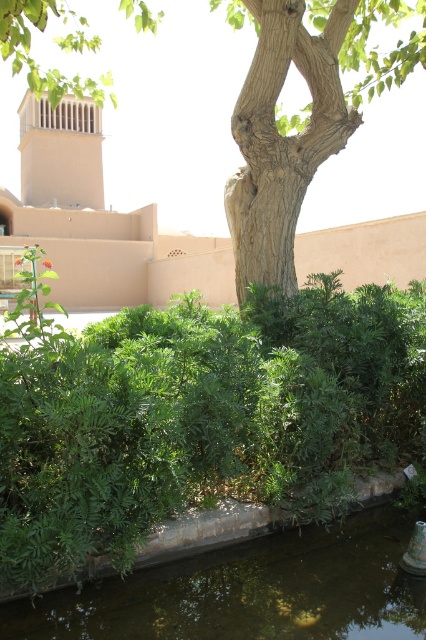
Question: Can you confirm if green leafy hedge at center is positioned to the right of greenish concrete water at bottom?

Choices:
 (A) no
 (B) yes

Answer: (A)

Question: Is green leafy hedge at center in front of smooth brown tree trunk at center?

Choices:
 (A) yes
 (B) no

Answer: (A)

Question: Which object is positioned closest to the greenish concrete water at bottom?

Choices:
 (A) smooth brown tree trunk at center
 (B) green leafy hedge at center

Answer: (B)

Question: Does smooth brown tree trunk at center appear under greenish concrete water at bottom?

Choices:
 (A) yes
 (B) no

Answer: (B)

Question: Which point is closer to the camera?

Choices:
 (A) smooth brown tree trunk at center
 (B) greenish concrete water at bottom
 (C) green leafy hedge at center

Answer: (C)

Question: Estimate the real-world distances between objects in this image. Which object is closer to the greenish concrete water at bottom?

Choices:
 (A) green leafy hedge at center
 (B) smooth brown tree trunk at center

Answer: (A)